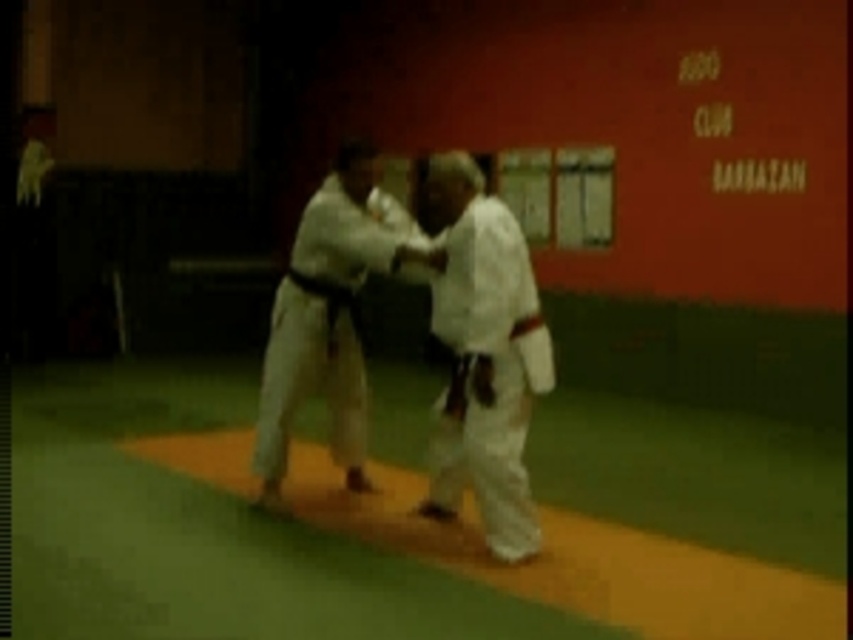
Is the position of white cloth kimono at center less distant than that of white karate gi at center?

That is True.

Does white cloth kimono at center appear on the left side of white karate gi at center?

Incorrect, white cloth kimono at center is not on the left side of white karate gi at center.

Locate an element on the screen. The height and width of the screenshot is (640, 853). white cloth kimono at center is located at coordinates (485, 353).